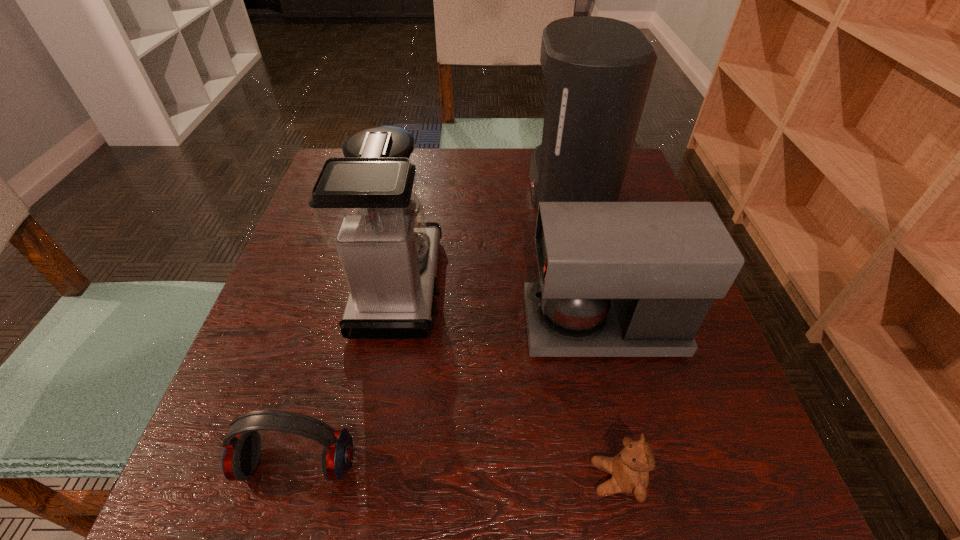
You are a GUI agent. You are given a task and a screenshot of the screen. Output one action in this format:
    pyautogui.click(x=<x>, y=<y>)
    Task: Click on the farthest object
    This screenshot has width=960, height=540.
    Given the screenshot: What is the action you would take?
    pyautogui.click(x=598, y=70)

At what (x,y) coordinates should I click in order to perform the action: click on the leftmost coffee maker. Please return your answer as a coordinate pair (x, y). The image size is (960, 540). Looking at the image, I should click on (366, 205).

Identify the location of the second tallest coffee maker. This screenshot has height=540, width=960. (366, 205).

You are a GUI agent. You are given a task and a screenshot of the screen. Output one action in this format:
    pyautogui.click(x=<x>, y=<y>)
    Task: Click on the third shortest object
    The image size is (960, 540).
    Given the screenshot: What is the action you would take?
    pyautogui.click(x=617, y=279)

The image size is (960, 540). I want to click on the second shortest object, so click(242, 446).

Locate an element on the screen. This screenshot has width=960, height=540. teddy bear is located at coordinates (630, 468).

Image resolution: width=960 pixels, height=540 pixels. In order to click on vacant space situated on the button side of the farthest coffee maker in this screenshot , I will do `click(426, 187)`.

This screenshot has height=540, width=960. Find the location of `free space located on the button side of the farthest coffee maker`. free space located on the button side of the farthest coffee maker is located at coordinates coord(403,187).

Find the location of a particular element. The height and width of the screenshot is (540, 960). blank space located on the button side of the farthest coffee maker is located at coordinates (492, 187).

What are the coordinates of `vacant space located at the front of the second tallest coffee maker where the controls are located` in the screenshot? It's located at (536, 285).